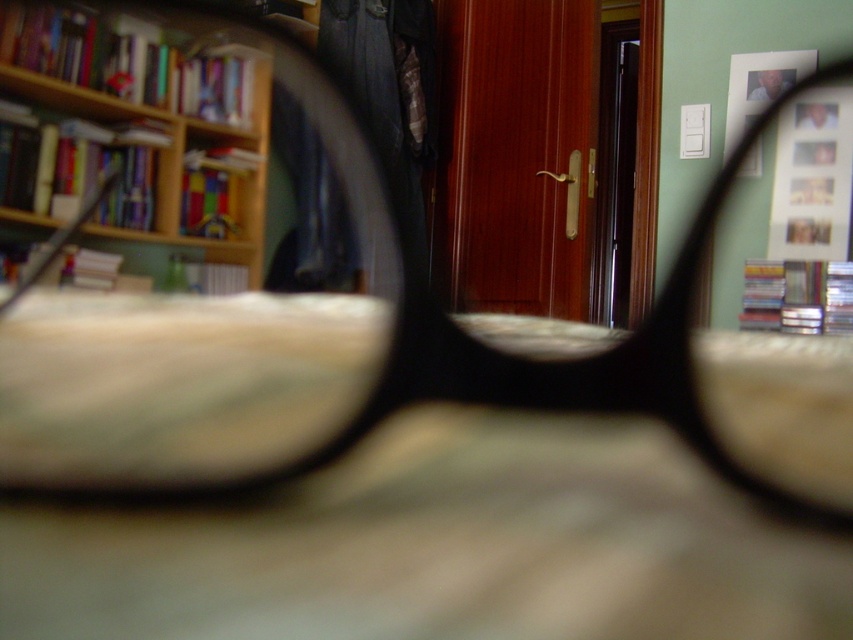
Which of these two, wooden bookcase at upper left or matte plastic picture frame at upper right, stands shorter?

matte plastic picture frame at upper right is shorter.

Does wooden bookcase at upper left appear on the right side of matte plastic picture frame at upper right?

No, wooden bookcase at upper left is not to the right of matte plastic picture frame at upper right.

In order to click on wooden bookcase at upper left in this screenshot , I will do `click(144, 124)`.

Can you confirm if transparent plastic magnifying glass at center is thinner than matte plastic picture frame at upper right?

No, transparent plastic magnifying glass at center is not thinner than matte plastic picture frame at upper right.

What do you see at coordinates (206, 296) in the screenshot? The height and width of the screenshot is (640, 853). I see `transparent plastic magnifying glass at center` at bounding box center [206, 296].

I want to click on transparent plastic magnifying glass at center, so click(206, 296).

Between transparent plastic magnifying glass at center and wooden bookcase at upper left, which one is positioned higher?

wooden bookcase at upper left is above.

How much distance is there between transparent plastic magnifying glass at center and wooden bookcase at upper left?

transparent plastic magnifying glass at center is 3.44 inches from wooden bookcase at upper left.

Between point (358, 188) and point (3, 6), which one is positioned behind?

Positioned behind is point (358, 188).

Locate an element on the screen. Image resolution: width=853 pixels, height=640 pixels. transparent plastic magnifying glass at center is located at coordinates (206, 296).